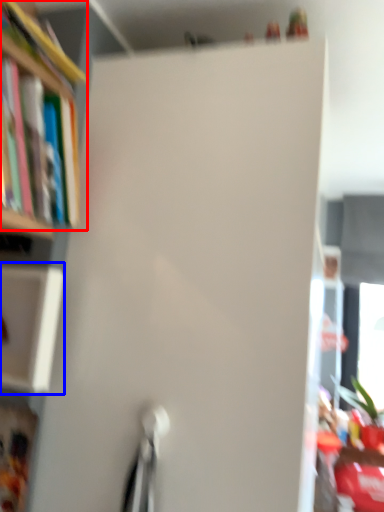
Question: Which object appears farthest to the camera in this image, book (highlighted by a red box) or cabinet (highlighted by a blue box)?

Choices:
 (A) book
 (B) cabinet

Answer: (B)